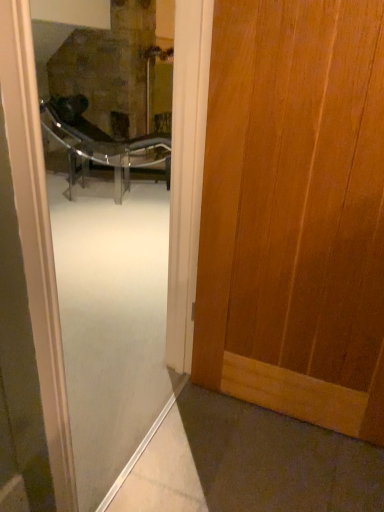
Question: From a real-world perspective, is wooden door at right positioned under transparent glass screen door at center based on gravity?

Choices:
 (A) no
 (B) yes

Answer: (A)

Question: Is wooden door at right bigger than transparent glass screen door at center?

Choices:
 (A) yes
 (B) no

Answer: (B)

Question: Does wooden door at right have a lesser height compared to transparent glass screen door at center?

Choices:
 (A) yes
 (B) no

Answer: (A)

Question: Does wooden door at right have a smaller size compared to transparent glass screen door at center?

Choices:
 (A) no
 (B) yes

Answer: (B)

Question: Considering the relative positions of wooden door at right and transparent glass screen door at center in the image provided, is wooden door at right in front of transparent glass screen door at center?

Choices:
 (A) no
 (B) yes

Answer: (A)

Question: Considering the positions of wooden door at right and metallic glass chair at center in the image, is wooden door at right taller or shorter than metallic glass chair at center?

Choices:
 (A) short
 (B) tall

Answer: (B)

Question: From the image's perspective, is wooden door at right located above or below metallic glass chair at center?

Choices:
 (A) below
 (B) above

Answer: (A)

Question: Considering the positions of wooden door at right and metallic glass chair at center in the image, is wooden door at right wider or thinner than metallic glass chair at center?

Choices:
 (A) wide
 (B) thin

Answer: (B)

Question: Is wooden door at right inside the boundaries of metallic glass chair at center, or outside?

Choices:
 (A) outside
 (B) inside

Answer: (A)

Question: Is point (86, 157) closer or farther from the camera than point (334, 374)?

Choices:
 (A) farther
 (B) closer

Answer: (A)

Question: From the image's perspective, is metallic glass chair at center located above or below wooden door at right?

Choices:
 (A) below
 (B) above

Answer: (B)

Question: Is metallic glass chair at center to the left or to the right of wooden door at right in the image?

Choices:
 (A) left
 (B) right

Answer: (A)

Question: In terms of width, does metallic glass chair at center look wider or thinner when compared to wooden door at right?

Choices:
 (A) thin
 (B) wide

Answer: (B)

Question: Based on their sizes in the image, would you say metallic glass chair at center is bigger or smaller than transparent glass screen door at center?

Choices:
 (A) small
 (B) big

Answer: (B)

Question: Is metallic glass chair at center spatially inside transparent glass screen door at center, or outside of it?

Choices:
 (A) inside
 (B) outside

Answer: (B)